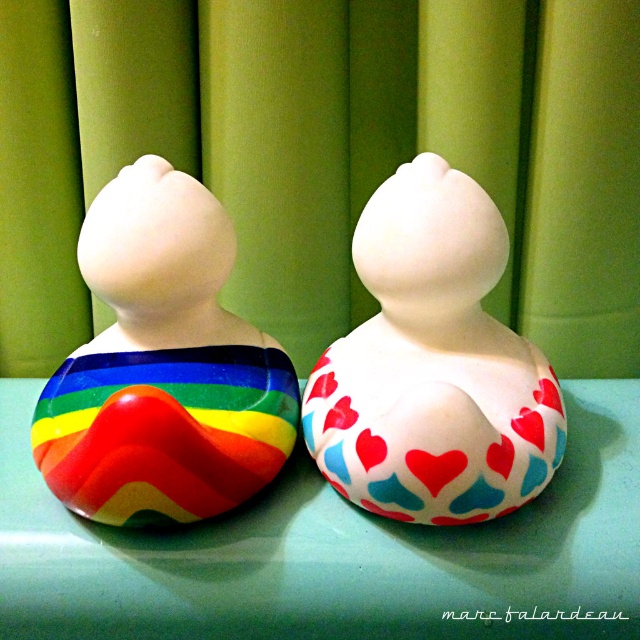
Question: Estimate the real-world distances between objects in this image. Which object is farther from the green glossy table at center?

Choices:
 (A) rainbow glossy rubber duck at left
 (B) matte white rubber duck at center

Answer: (A)

Question: Considering the relative positions of green glossy table at center and matte white rubber duck at center in the image provided, where is green glossy table at center located with respect to matte white rubber duck at center?

Choices:
 (A) below
 (B) above

Answer: (A)

Question: Does matte white rubber duck at center appear on the left side of rainbow glossy rubber duck at left?

Choices:
 (A) yes
 (B) no

Answer: (B)

Question: Among these points, which one is nearest to the camera?

Choices:
 (A) (163, 272)
 (B) (380, 436)
 (C) (310, 522)

Answer: (B)

Question: Is green glossy table at center positioned in front of matte white rubber duck at center?

Choices:
 (A) no
 (B) yes

Answer: (B)

Question: Which point is closer to the camera taking this photo?

Choices:
 (A) (244, 368)
 (B) (440, 628)

Answer: (B)